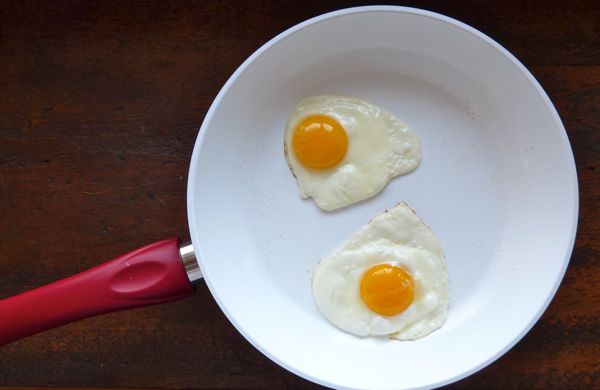
At what (x,y) coordinates should I click in order to perform the action: click on plate. Please return your answer as a coordinate pair (x, y). Image resolution: width=600 pixels, height=390 pixels. Looking at the image, I should click on (285, 228).